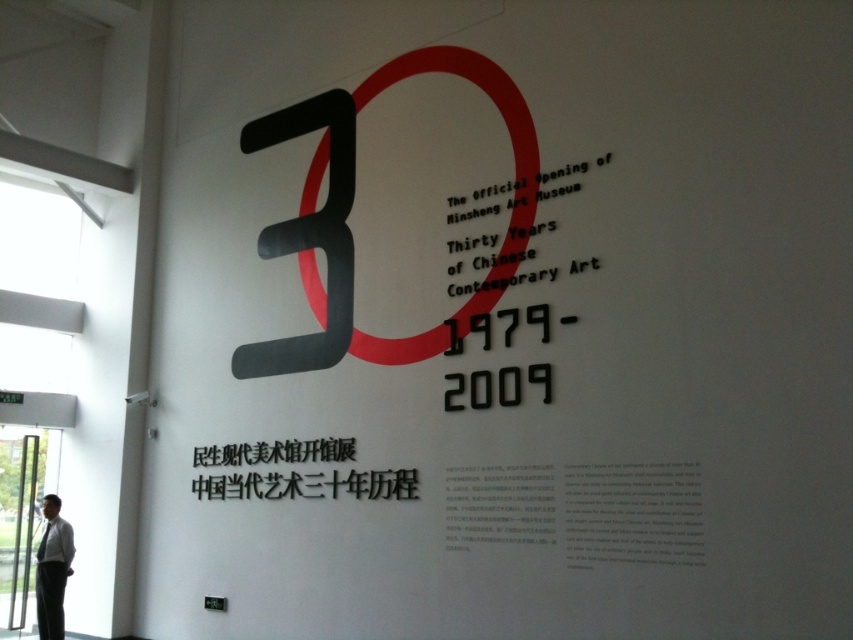
Who is taller, black paper text at center or white shirt at lower left?

With more height is white shirt at lower left.

Does point (387, 481) lie in front of point (38, 582)?

Yes, it is in front of point (38, 582).

Describe the element at coordinates (308, 484) in the screenshot. I see `black paper text at center` at that location.

At what (x,y) coordinates should I click in order to perform the action: click on black paper text at center. Please return your answer as a coordinate pair (x, y). The height and width of the screenshot is (640, 853). Looking at the image, I should click on (308, 484).

Is matte red circle at center to the left of black paper text at center from the viewer's perspective?

In fact, matte red circle at center is to the right of black paper text at center.

Does matte red circle at center appear under black paper text at center?

Incorrect, matte red circle at center is not positioned below black paper text at center.

Does point (387, 65) come closer to viewer compared to point (235, 481)?

Yes, it is in front of point (235, 481).

Locate an element on the screen. The image size is (853, 640). matte red circle at center is located at coordinates (511, 148).

Who is more forward, [251,452] or [546,314]?

Point [546,314]

Between black paper text at center and black metallic text at center, which one is positioned lower?

Positioned lower is black paper text at center.

Does point (260, 442) come behind point (602, 161)?

Yes.

Where is `black paper text at center`? black paper text at center is located at coordinates (308, 484).